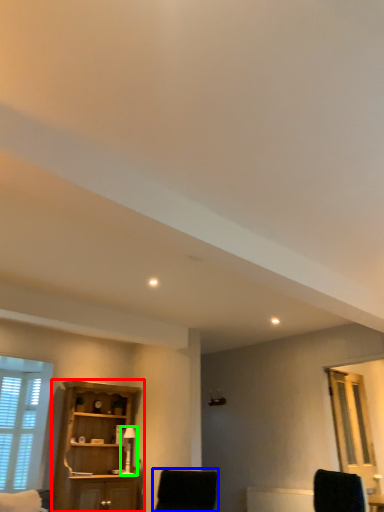
Question: Based on their relative distances, which object is nearer to cupboard (highlighted by a red box)? Choose from chair (highlighted by a blue box) and table lamp (highlighted by a green box).

Choices:
 (A) chair
 (B) table lamp

Answer: (B)